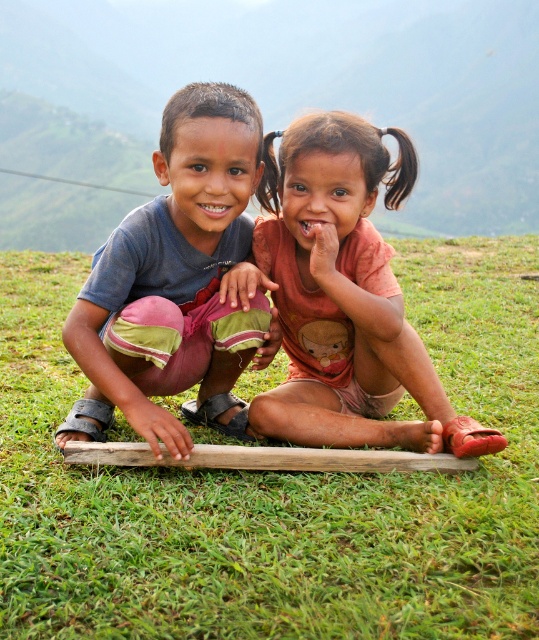
You are standing at the origin point in the image. Which of the two points, point (305,269) or point (261,348), is farther from you?

Point (305,269) is farther from you because it is behind point (261,348).

You are a photographer trying to capture a photo of the two children. You notice the green grass at lower center and the matte blue shirt at center. Which object is located to the right of the other?

The green grass at lower center is positioned on the right side of matte blue shirt at center, so the green grass at lower center is to the right of the matte blue shirt at center.

You are a photographer trying to capture a candid shot of the two children in the scene. You notice their shirts are of different lengths. Which shirt, the orange cotton shirt at center or the matte blue shirt at center, would you adjust to ensure both shirts are of equal length in the photo?

The orange cotton shirt at center is shorter than the matte blue shirt at center. To make them equal in length in the photo, you should adjust the orange cotton shirt at center by pulling it down or the matte blue shirt at center by pushing it up.